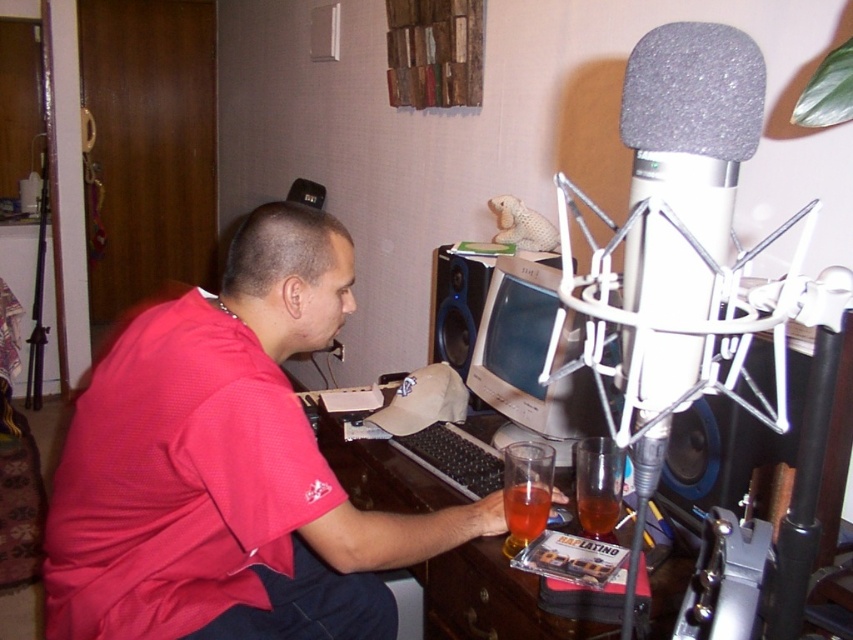
You are setting up a camera to film the person at the desk. The camera can only focus on objects above the black matte speaker at center. Will the red mesh polo shirt at left be in focus?

The red mesh polo shirt at left is located below the black matte speaker at center, so it will not be in focus since the camera focuses on objects above the speaker.

You are setting up a new microphone stand in the home office. The stand needs to be placed between the black matte speaker at center and the translucent glass at desk center. Which object should the stand be closer to if it must be positioned closer to the viewer?

The microphone stand should be placed closer to the black matte speaker at center because it is nearer to the viewer compared to the translucent glass at desk center.

You are organizing a small event and need to know if the red mesh polo shirt at left can fit into the brown wooden drawer at lower center. Based on the scene description, can it fit?

The red mesh polo shirt at left is wider than the brown wooden drawer at lower center, so it might not fit inside the drawer.